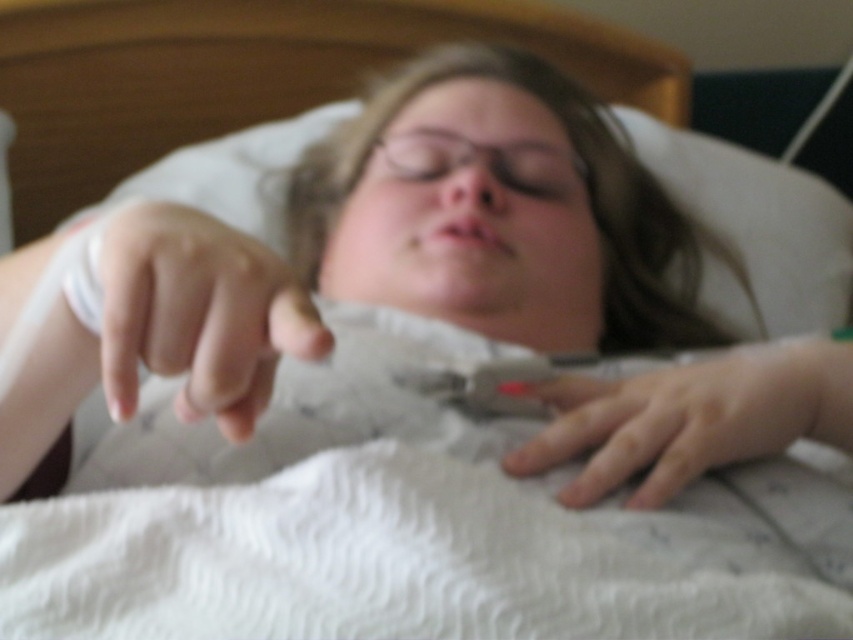
Question: Is smooth skin finger at center to the left of smooth skin hand at lower center from the viewer's perspective?

Choices:
 (A) no
 (B) yes

Answer: (B)

Question: Among these objects, which one is farthest from the camera?

Choices:
 (A) smooth skin hand at lower center
 (B) smooth skin finger at center

Answer: (A)

Question: Does smooth skin finger at center appear on the right side of smooth skin hand at lower center?

Choices:
 (A) yes
 (B) no

Answer: (B)

Question: Which point appears closest to the camera in this image?

Choices:
 (A) (276, 312)
 (B) (766, 392)

Answer: (A)

Question: Can you confirm if smooth skin finger at center is positioned above smooth skin hand at lower center?

Choices:
 (A) no
 (B) yes

Answer: (B)